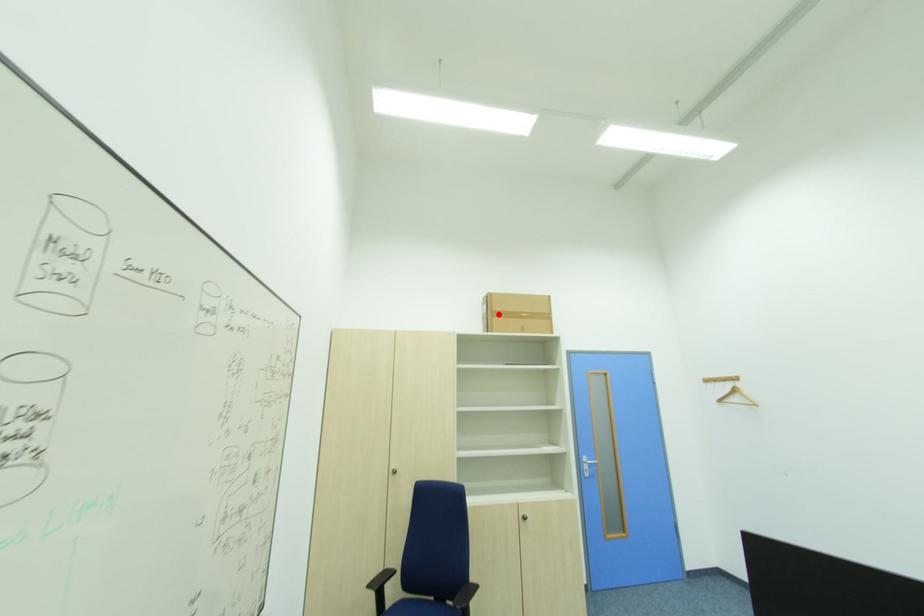
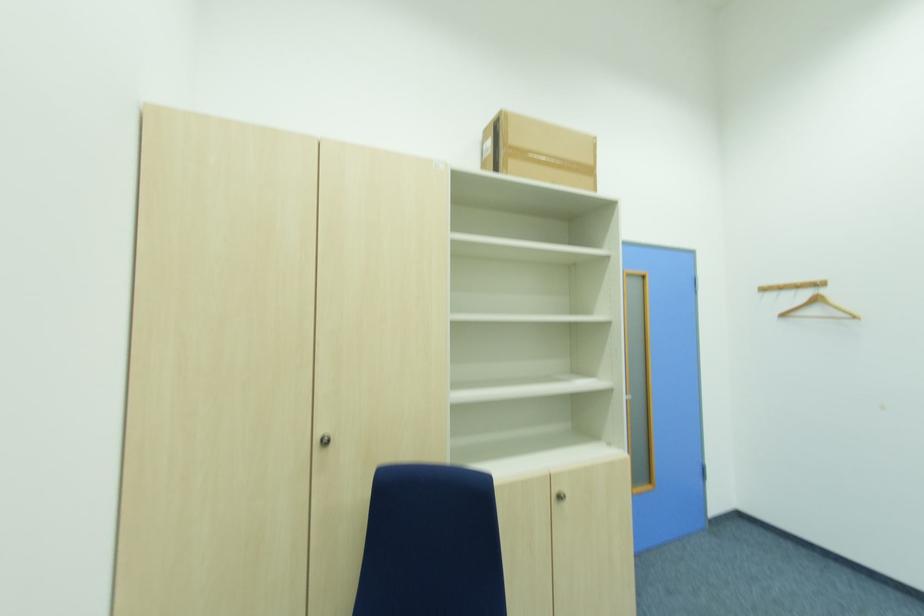
In the second image, find the point that corresponds to the highlighted location in the first image.

(515, 150)